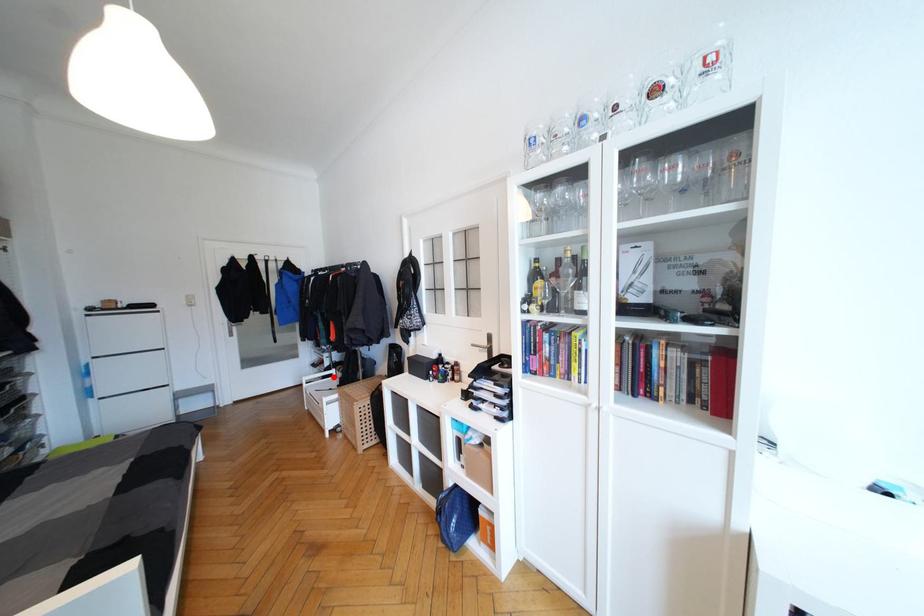
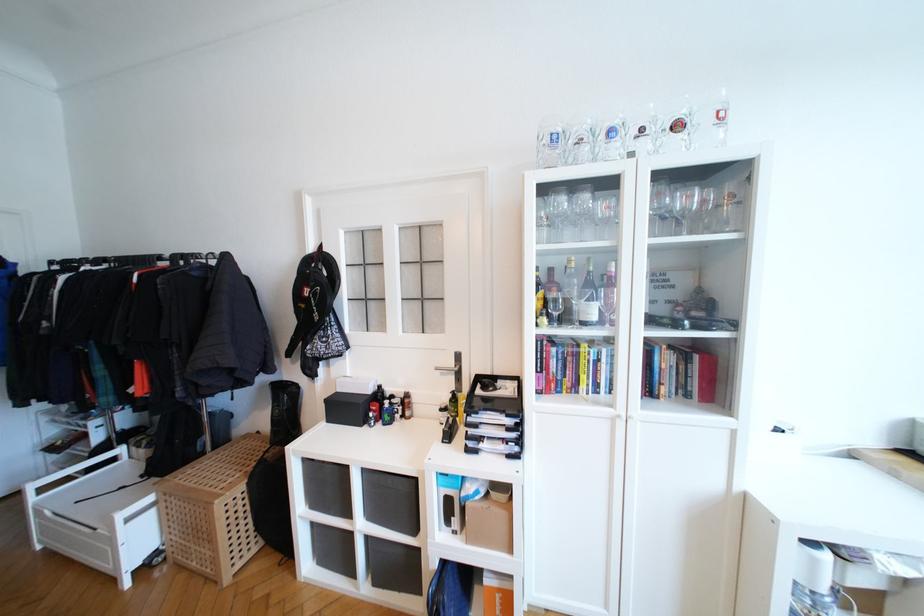
Question: A red point is marked in image1. In image2, is the corresponding 3D point closer to the camera or farther? Reply with the corresponding letter.

Choices:
 (A) The corresponding 3D point is closer.
 (B) The corresponding 3D point is farther.

Answer: (A)